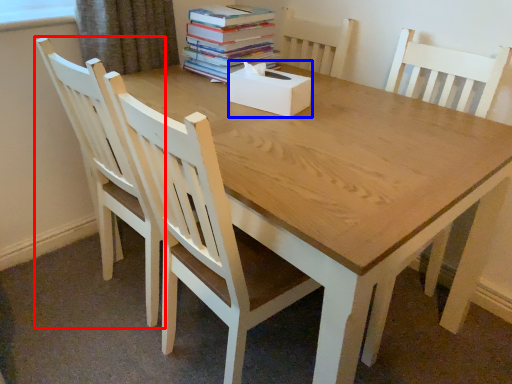
Question: Which point is closer to the camera, chair (highlighted by a red box) or box (highlighted by a blue box)?

Choices:
 (A) chair
 (B) box

Answer: (A)